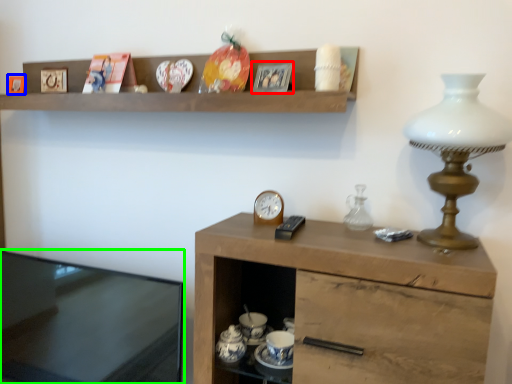
Question: Which is nearer to the picture frame (highlighted by a red box)? picture frame (highlighted by a blue box) or desk (highlighted by a green box).

Choices:
 (A) picture frame
 (B) desk

Answer: (A)